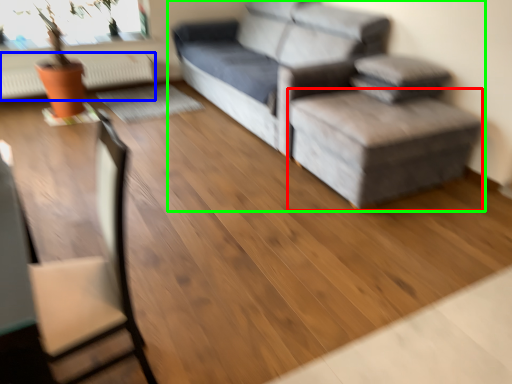
Question: Which object is the farthest from stool (highlighted by a red box)? Choose among these: radiator (highlighted by a blue box) or studio couch (highlighted by a green box).

Choices:
 (A) radiator
 (B) studio couch

Answer: (A)